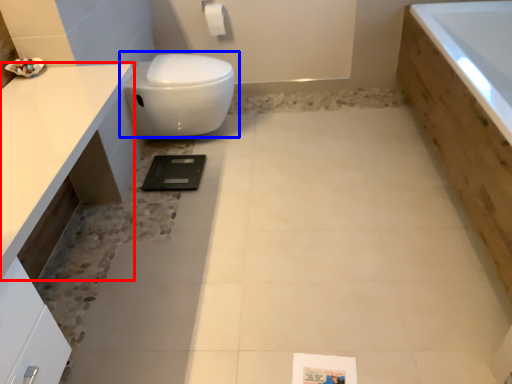
Question: Among these objects, which one is farthest to the camera, countertop (highlighted by a red box) or toilet (highlighted by a blue box)?

Choices:
 (A) countertop
 (B) toilet

Answer: (B)